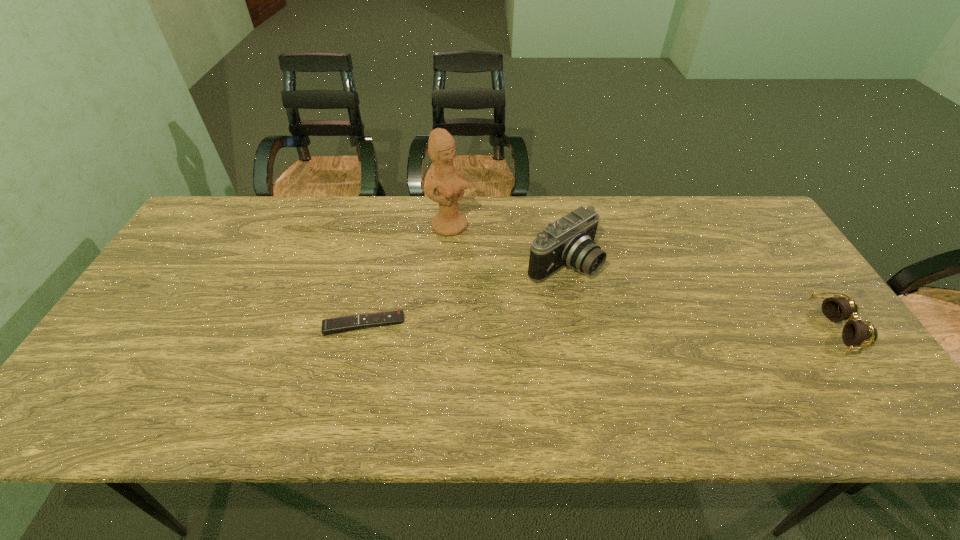
Find the location of a particular element. Image resolution: width=960 pixels, height=540 pixels. vacant space at the far edge of the desktop is located at coordinates (300, 233).

Locate an element on the screen. This screenshot has height=540, width=960. vacant region at the near edge is located at coordinates (297, 384).

The width and height of the screenshot is (960, 540). I want to click on vacant region at the left edge of the desktop, so click(x=166, y=352).

Locate an element on the screen. blank space at the near left corner of the desktop is located at coordinates (132, 375).

At what (x,y) coordinates should I click in order to perform the action: click on vacant space that's between the remote control and the second farthest object. Please return your answer as a coordinate pair (x, y). The width and height of the screenshot is (960, 540). Looking at the image, I should click on (463, 293).

In order to click on empty space between the shortest object and the tallest object in this screenshot , I will do `click(407, 275)`.

Image resolution: width=960 pixels, height=540 pixels. I want to click on empty space between the leftmost object and the figurine, so click(407, 275).

This screenshot has height=540, width=960. I want to click on vacant region between the tallest object and the shortest object, so click(407, 275).

Find the location of `empty space that is in between the leftmost object and the figurine`. empty space that is in between the leftmost object and the figurine is located at coordinates (407, 275).

Locate an element on the screen. vacant area that lies between the shortest object and the goggles is located at coordinates (600, 327).